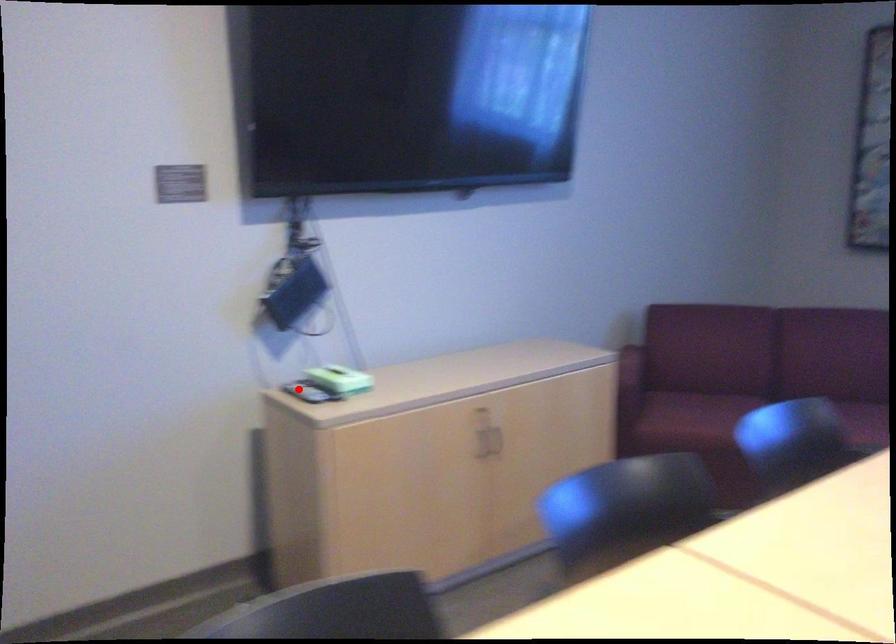
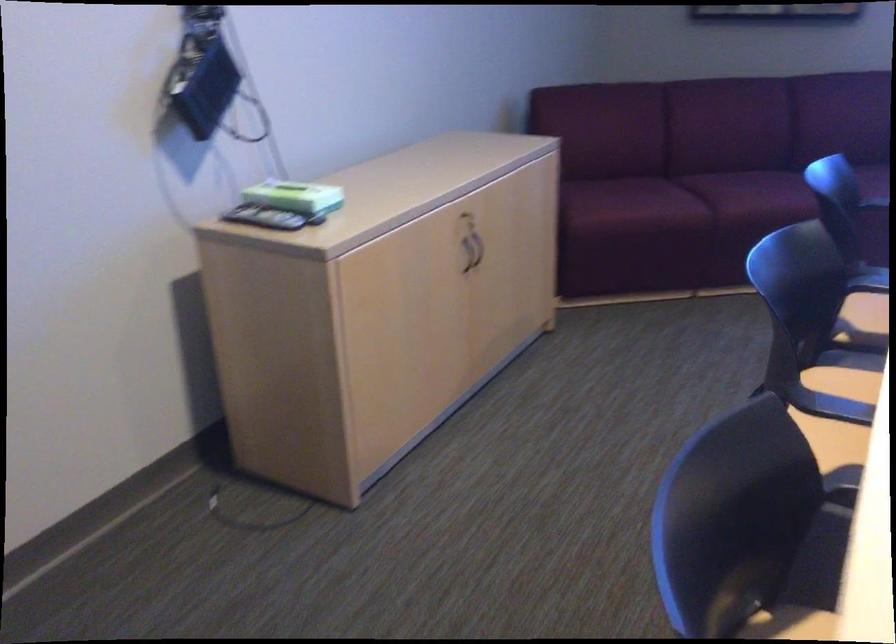
Question: I am providing you with two images of the same scene from different viewpoints. Given a red point in image1, look at the same physical point in image2. Is it:

Choices:
 (A) Closer to the viewpoint
 (B) Farther from the viewpoint

Answer: (A)